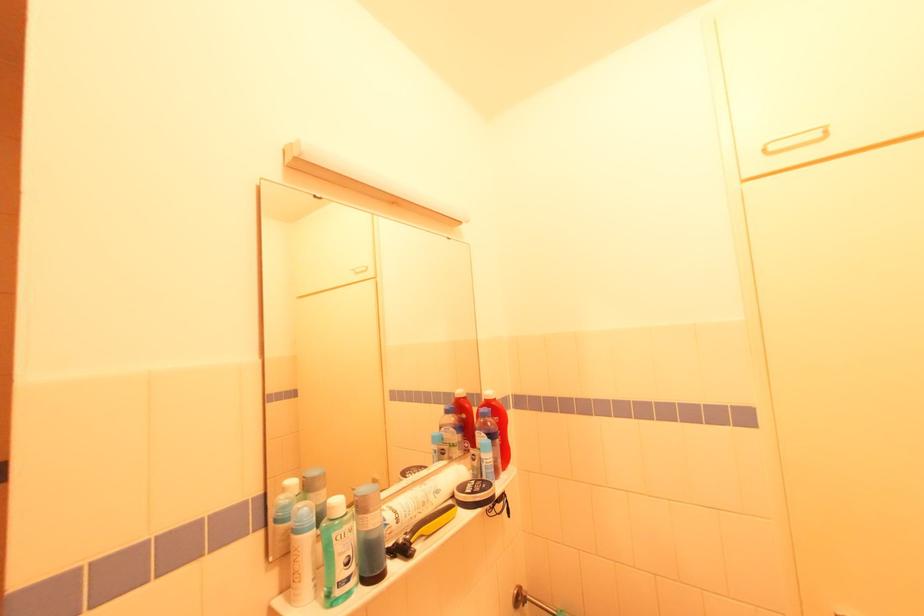
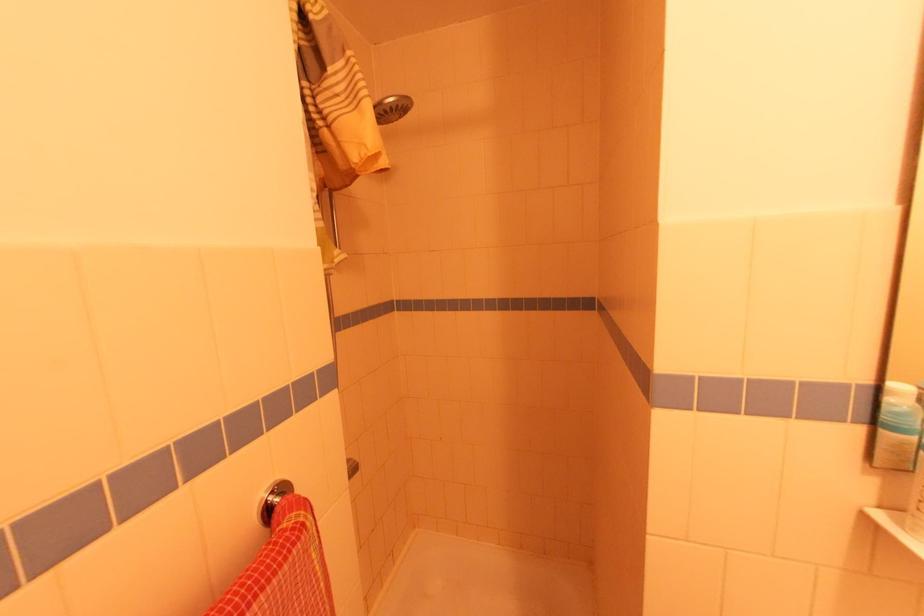
Question: The camera is either moving clockwise (left) or counter-clockwise (right) around the object. The first image is from the beginning of the video and the second image is from the end. Is the camera moving left or right when shooting the video?

Choices:
 (A) Left
 (B) Right

Answer: (B)